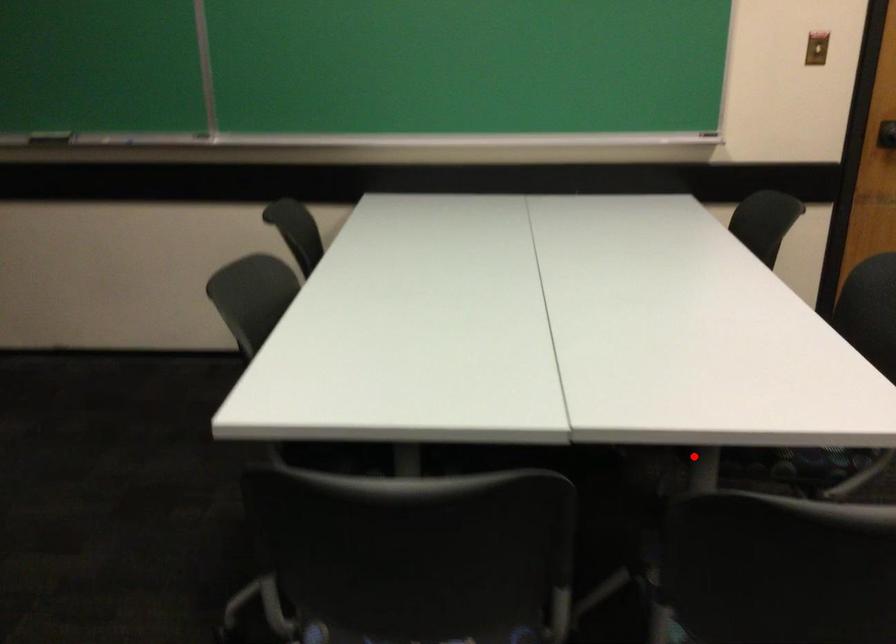
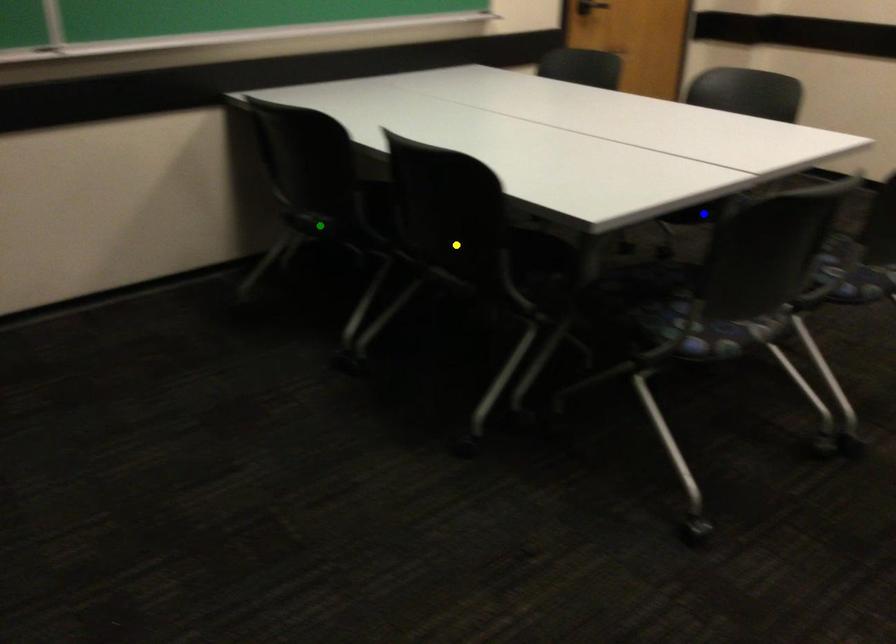
Question: I am providing you with two images of the same scene from different viewpoints. A red point is marked on the first image. You are given multiple points on the second image. Can you choose the point in image 2 that corresponds to the point in image 1?

Choices:
 (A) green point
 (B) yellow point
 (C) blue point

Answer: (C)